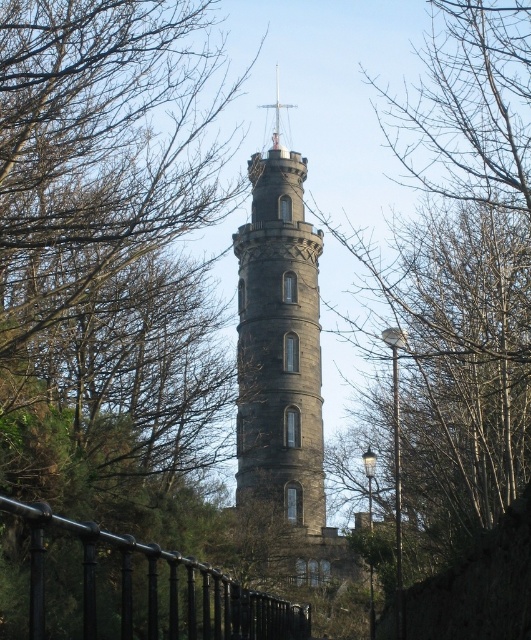
Between point (304, 500) and point (33, 502), which one is positioned behind?

The point (304, 500) is behind.

Can you confirm if dark stone tower at center is positioned above black metal fence at lower left?

Yes.

What do you see at coordinates (278, 371) in the screenshot?
I see `dark stone tower at center` at bounding box center [278, 371].

The width and height of the screenshot is (531, 640). What are the coordinates of `dark stone tower at center` in the screenshot? It's located at (278, 371).